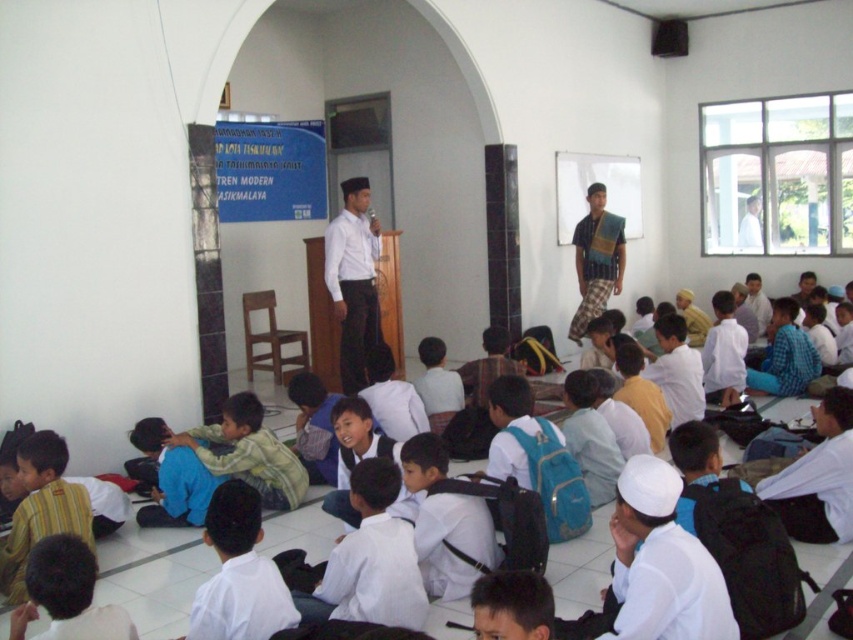
In the classroom scene, there is a white matte shirt at center and a wooden podium with a microphone on the left side. Which object is closer to the point marked at coordinates (352,280)?

The white matte shirt at center is located at point (352,280), so it is exactly at that coordinate, making it the closest object to the point.

Based on the coordinates provided, which object in the scene is located at point (x=817, y=477)?

The point (x=817, y=477) corresponds to the white uniform shirt at lower right.

You are a student sitting in the classroom and need to hand in an assignment to the teacher. The teacher is wearing a striped cotton shirt at lower left. However, there is another person in the room wearing a white uniform shirt at lower right. Which direction should you walk to reach the teacher first?

You should walk towards the striped cotton shirt at lower left because the teacher is wearing it, and since the white uniform shirt at lower right is to the right of the striped cotton shirt at lower left, moving towards the left direction will lead you directly to the teacher without detouring past the other individual.